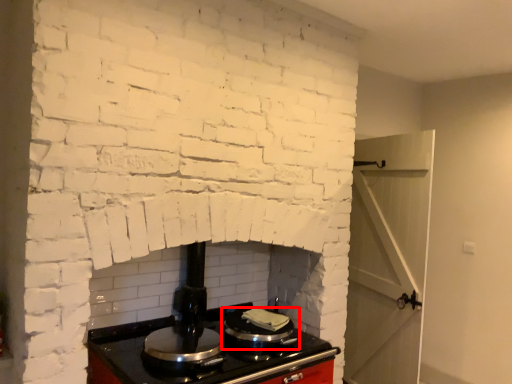
Question: From the image's perspective, considering the relative positions of kitchen appliance (annotated by the red box) and appliance in the image provided, where is kitchen appliance (annotated by the red box) located with respect to the staircase?

Choices:
 (A) above
 (B) below

Answer: (A)